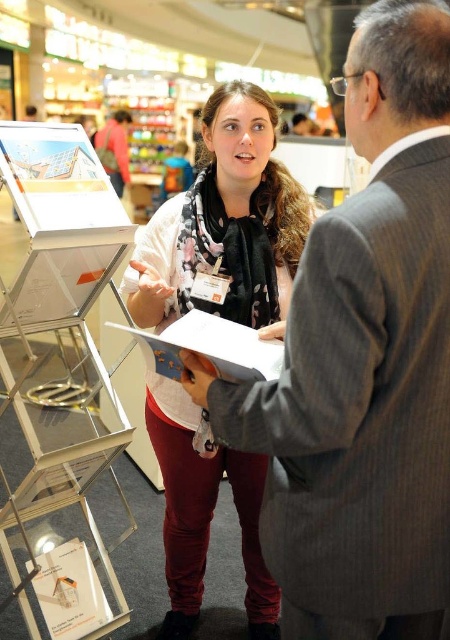
You are a customer at the mall and want to know which item is narrower between the gray suit at center and the floral scarf at center. Can you determine this based on the description?

The gray suit at center has a lesser width compared to the floral scarf at center, so the gray suit at center is narrower.

You are a visitor at the mall and want to take a photo of both the floral scarf at center and the white paper at center. Which one should you zoom in on to ensure both are clearly visible in the frame?

The floral scarf at center is bigger than the white paper at center, so you should zoom in on the floral scarf at center to ensure both are clearly visible in the frame.